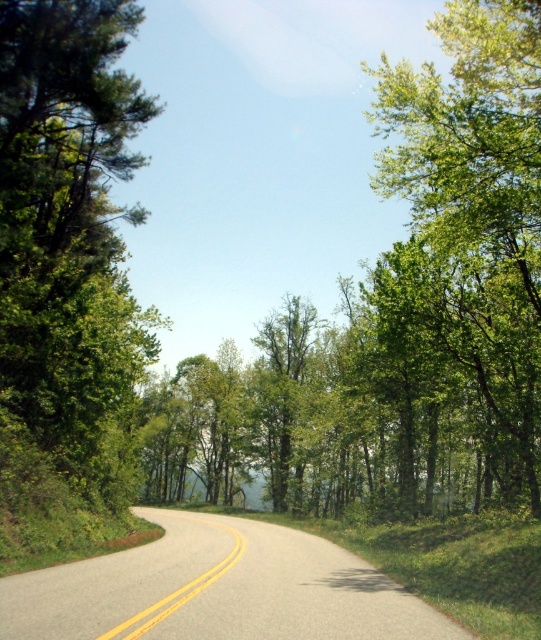
You are driving a car that is 2 meters wide. You see the green leafy tree at left and the green leafy tree at center. Can your car pass between them without hitting either tree?

The green leafy tree at left is narrower than the green leafy tree at center. Since the distance between them isn

You are driving along the scenic road and notice two trees ahead. The first is a green leafy tree at left, and the second is a green leafy tree at upper right. Which tree is closer to the road?

The green leafy tree at left is closer to the road because it is positioned under the green leafy tree at upper right, indicating it is in front and therefore nearer to the observer.